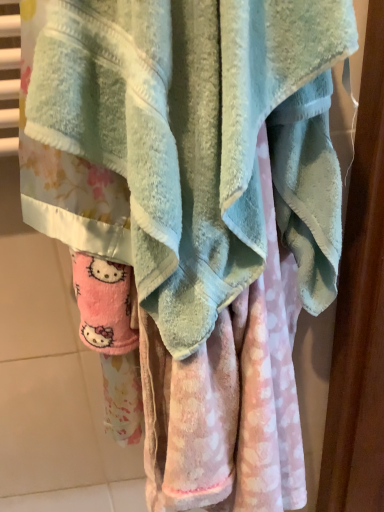
What do you see at coordinates (189, 144) in the screenshot?
I see `soft pink plush towel at center` at bounding box center [189, 144].

Locate an element on the screen. soft pink plush towel at center is located at coordinates (189, 144).

Image resolution: width=384 pixels, height=512 pixels. Find the location of `soft pink plush towel at center`. soft pink plush towel at center is located at coordinates (189, 144).